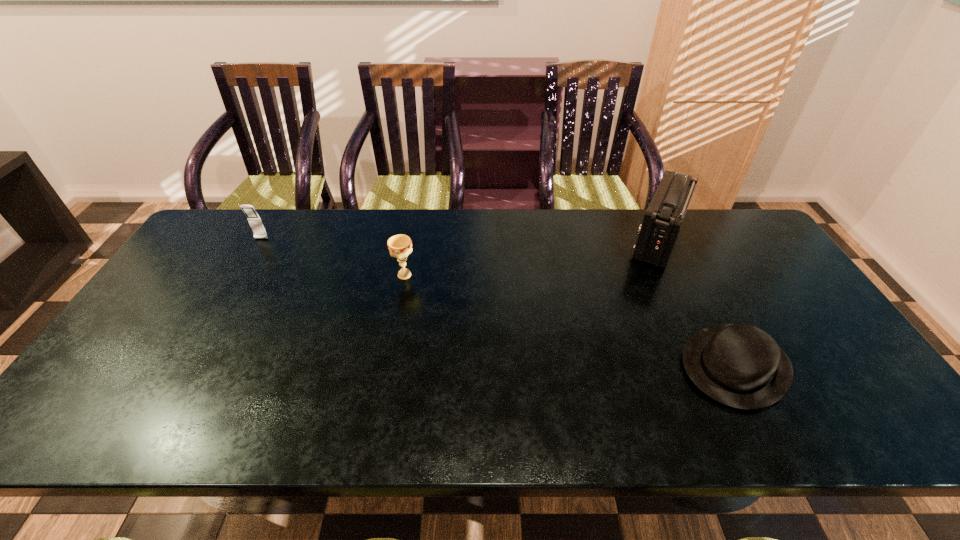
The height and width of the screenshot is (540, 960). Identify the location of vacant point located 0.200m on the left of the shortest object. (599, 366).

Find the location of a particular element. The height and width of the screenshot is (540, 960). radio receiver at the far edge is located at coordinates (662, 221).

Identify the location of cellular telephone that is at the far edge. The width and height of the screenshot is (960, 540). (253, 218).

The image size is (960, 540). What are the coordinates of `object situated at the near edge` in the screenshot? It's located at (739, 365).

This screenshot has height=540, width=960. What are the coordinates of `object that is at the right edge` in the screenshot? It's located at (739, 365).

The height and width of the screenshot is (540, 960). I want to click on object at the near right corner, so click(x=739, y=365).

Find the location of `vacant space at the far edge`. vacant space at the far edge is located at coordinates (393, 216).

Image resolution: width=960 pixels, height=540 pixels. I want to click on free region at the near edge of the desktop, so click(480, 437).

Find the location of a particular element. free space at the left edge is located at coordinates (201, 274).

Where is `free space at the right edge of the desktop`? free space at the right edge of the desktop is located at coordinates (785, 275).